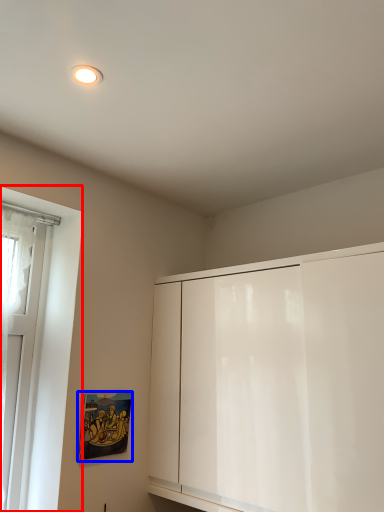
Question: Which object is closer to the camera taking this photo, window (highlighted by a red box) or picture frame (highlighted by a blue box)?

Choices:
 (A) window
 (B) picture frame

Answer: (A)